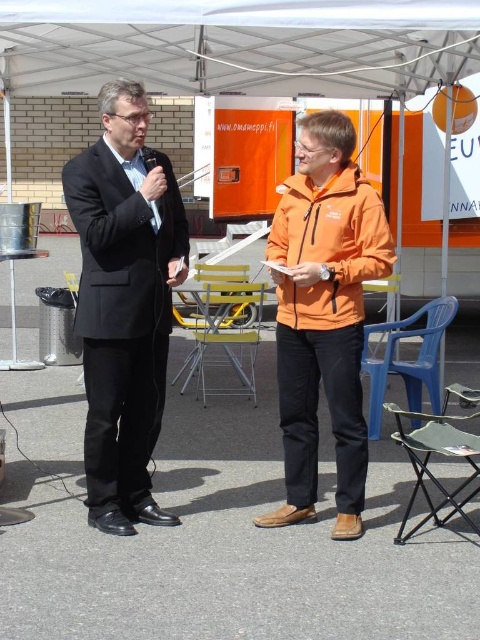
Question: In this image, where is orange matte jacket at center located relative to orange softshell jacket at center?

Choices:
 (A) below
 (B) above

Answer: (A)

Question: Does matte black suit at left appear on the left side of orange matte jacket at center?

Choices:
 (A) yes
 (B) no

Answer: (A)

Question: Which object appears farthest from the camera in this image?

Choices:
 (A) matte black suit at left
 (B) orange softshell jacket at center
 (C) orange matte jacket at center

Answer: (C)

Question: Which of these objects is positioned closest to the orange softshell jacket at center?

Choices:
 (A) matte black suit at left
 (B) orange matte jacket at center

Answer: (B)

Question: Can you confirm if matte black suit at left is smaller than orange softshell jacket at center?

Choices:
 (A) no
 (B) yes

Answer: (A)

Question: Which of the following is the closest to the observer?

Choices:
 (A) (300, 460)
 (B) (99, 106)

Answer: (B)